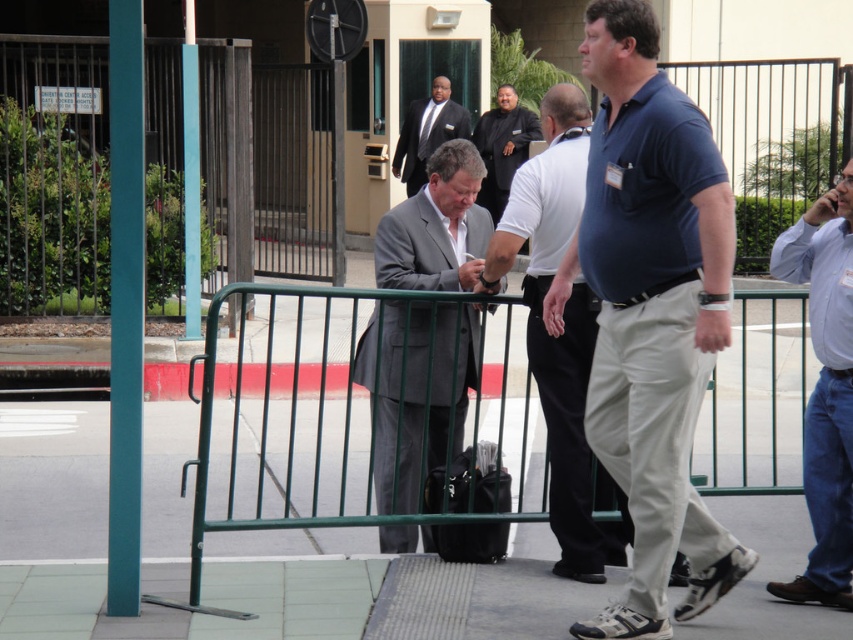
Question: Observing the image, what is the correct spatial positioning of blue cotton polo shirt at center in reference to matte black suit at center?

Choices:
 (A) left
 (B) right

Answer: (B)

Question: Is gray suit at center thinner than dark blue shirt at center?

Choices:
 (A) no
 (B) yes

Answer: (B)

Question: Which point appears closest to the camera in this image?

Choices:
 (A) (553, 412)
 (B) (827, 148)

Answer: (A)

Question: Among these objects, which one is nearest to the camera?

Choices:
 (A) blue cotton polo shirt at center
 (B) matte black suit at center

Answer: (A)

Question: Is gray suit at center wider than matte black suit at center?

Choices:
 (A) no
 (B) yes

Answer: (A)

Question: Which object appears closest to the camera in this image?

Choices:
 (A) green metal fence at center
 (B) blue cotton polo shirt at center

Answer: (B)